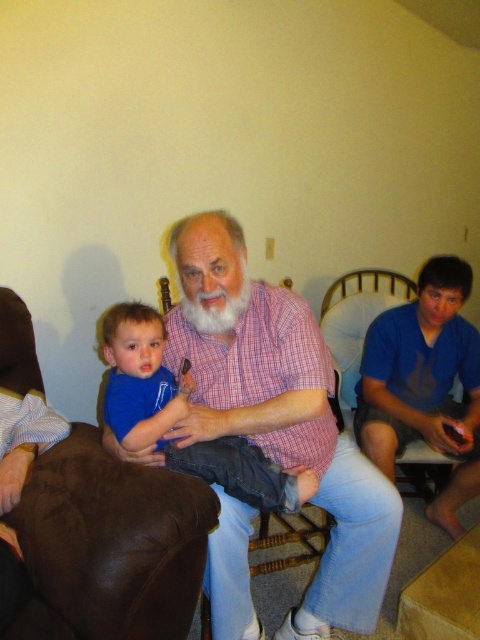
You are taking a photo of the scene and want to focus on both the point at [276,344] and the point at [8,449]. Which point should you adjust your focus to first if you want to ensure both are in focus?

You should focus on the point at [276,344] first because it is closer to the camera, allowing the point at [8,449] to be within the depth of field.

You are standing in the room and see the blue denim jeans at center and the whitehairbeard at center. Which one is positioned to the left?

The blue denim jeans at center is to the left of whitehairbeard at center.